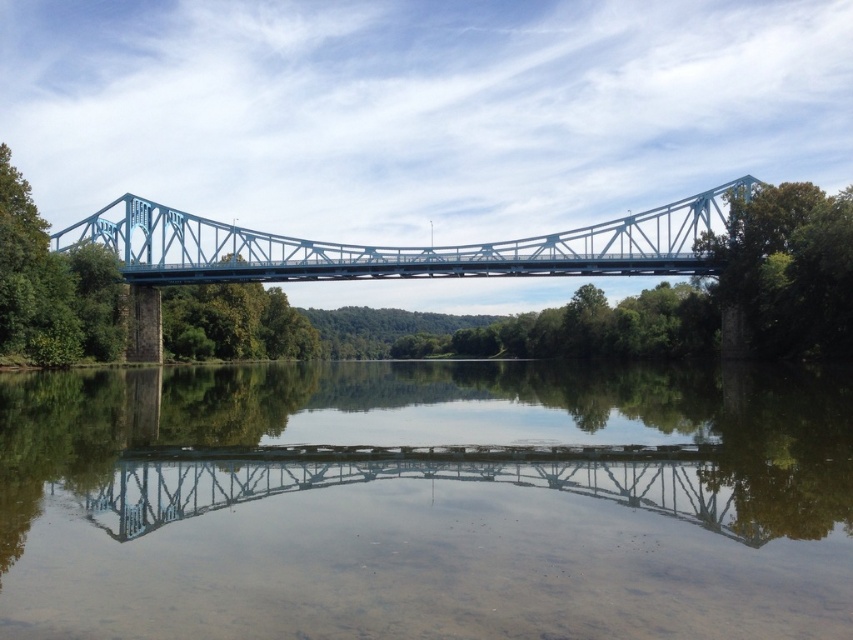
Question: Which point is farther to the camera?

Choices:
 (A) (790, 298)
 (B) (851, 552)
 (C) (502, 260)

Answer: (C)

Question: Among these points, which one is farthest from the camera?

Choices:
 (A) (735, 451)
 (B) (834, 221)

Answer: (B)

Question: Is clear water at center bigger than green leafy tree at upper right?

Choices:
 (A) no
 (B) yes

Answer: (B)

Question: Does clear water at center appear under blue metallic bridge at center?

Choices:
 (A) no
 (B) yes

Answer: (B)

Question: Which point is closer to the camera?

Choices:
 (A) blue metallic bridge at center
 (B) clear water at center
 (C) green leafy tree at upper right

Answer: (B)

Question: Does clear water at center appear on the left side of green leafy tree at upper right?

Choices:
 (A) no
 (B) yes

Answer: (B)